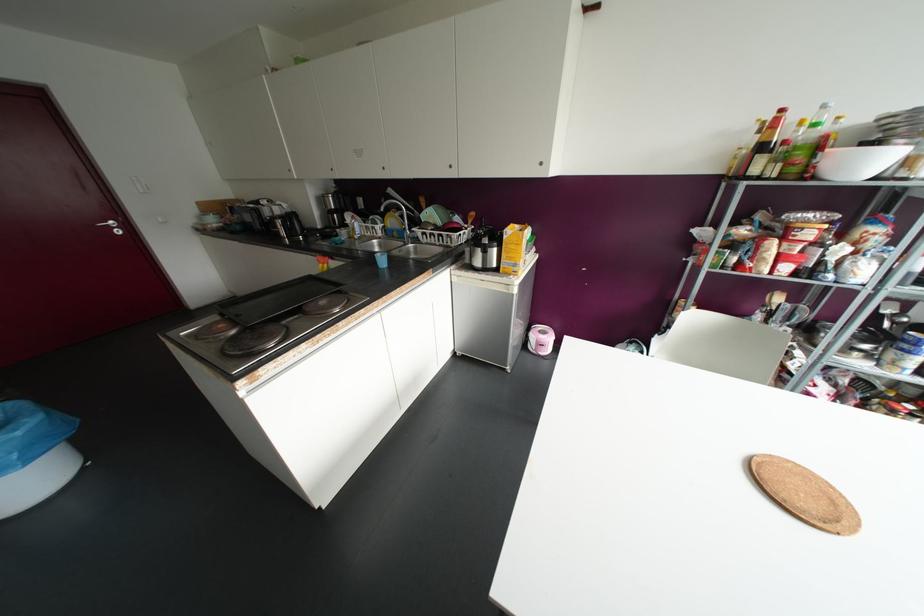
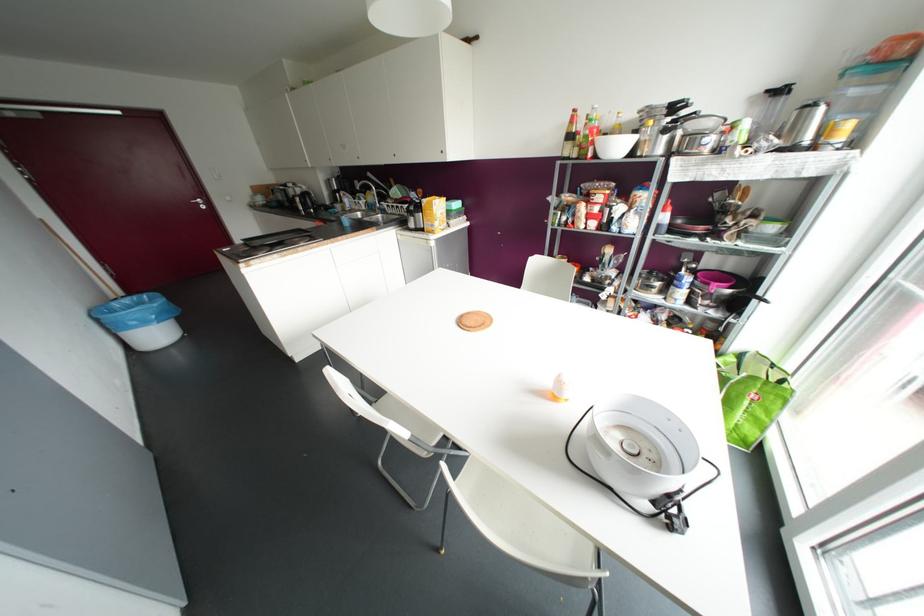
Where in the second image is the point corresponding to the point at 781,110 from the first image?

(574, 110)